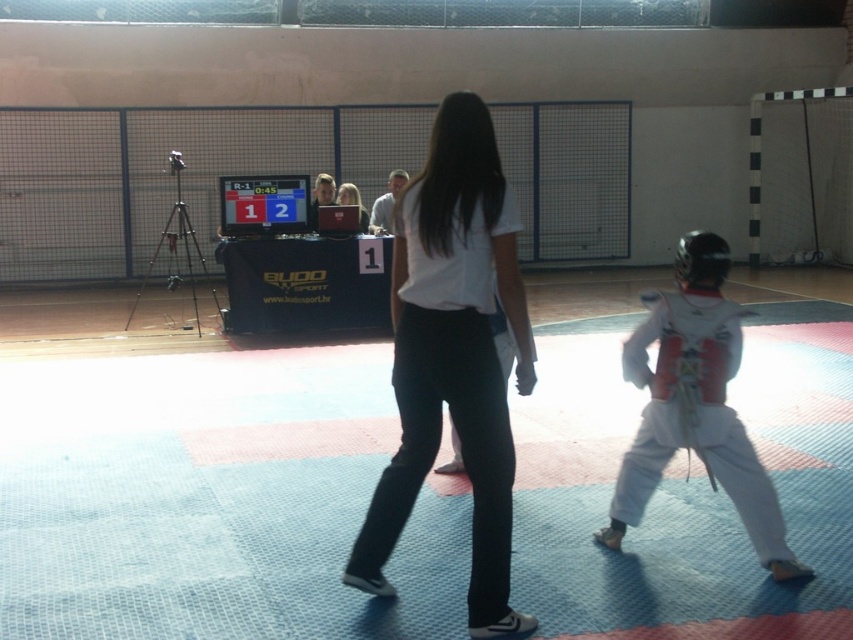
Is white karate uniform at right below matte white laptop at center?

Correct, white karate uniform at right is located below matte white laptop at center.

Between point (708, 454) and point (360, 202), which one is positioned behind?

Point (360, 202)

Identify the location of white karate uniform at right. (695, 404).

Who is higher up, white matte shirt at center or matte white laptop at center?

matte white laptop at center

Between point (491, 532) and point (366, 216), which one is positioned behind?

Positioned behind is point (366, 216).

Where is `white matte shirt at center`? This screenshot has width=853, height=640. white matte shirt at center is located at coordinates (453, 356).

Is white matte shirt at center to the left of white karate uniform at right from the viewer's perspective?

Yes, white matte shirt at center is to the left of white karate uniform at right.

Between point (419, 173) and point (683, 353), which one is positioned behind?

The point (419, 173) is more distant.

The width and height of the screenshot is (853, 640). I want to click on white matte shirt at center, so click(453, 356).

Image resolution: width=853 pixels, height=640 pixels. What are the coordinates of `white matte shirt at center` in the screenshot? It's located at (453, 356).